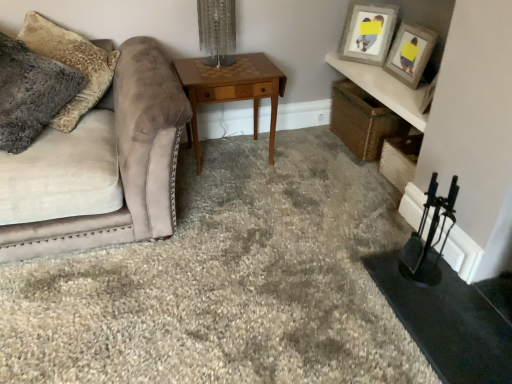
Question: Considering the relative sizes of matte gray picture frame at upper right, the first picture frame positioned from the right, and fuzzy gray pillow at left in the image provided, is matte gray picture frame at upper right, the first picture frame positioned from the right, thinner than fuzzy gray pillow at left?

Choices:
 (A) yes
 (B) no

Answer: (A)

Question: From a real-world perspective, is matte gray picture frame at upper right, the first picture frame positioned from the right, beneath fuzzy gray pillow at left?

Choices:
 (A) no
 (B) yes

Answer: (B)

Question: Is matte gray picture frame at upper right, the first picture frame positioned from the right, in contact with fuzzy gray pillow at left?

Choices:
 (A) yes
 (B) no

Answer: (B)

Question: Is matte gray picture frame at upper right, arranged as the 2th picture frame when viewed from the left, looking in the opposite direction of fuzzy gray pillow at left?

Choices:
 (A) yes
 (B) no

Answer: (B)

Question: Could you tell me if matte gray picture frame at upper right, the first picture frame positioned from the right, is facing fuzzy gray pillow at left?

Choices:
 (A) no
 (B) yes

Answer: (B)

Question: Considering the positions of point (182, 81) and point (202, 49), is point (182, 81) closer or farther from the camera than point (202, 49)?

Choices:
 (A) closer
 (B) farther

Answer: (A)

Question: Is woodenobject at center spatially inside clear glass table lamp at center, or outside of it?

Choices:
 (A) inside
 (B) outside

Answer: (B)

Question: Based on their positions, is woodenobject at center located to the left or right of clear glass table lamp at center?

Choices:
 (A) right
 (B) left

Answer: (A)

Question: From their relative heights in the image, would you say woodenobject at center is taller or shorter than clear glass table lamp at center?

Choices:
 (A) short
 (B) tall

Answer: (B)

Question: From the image's perspective, relative to fuzzy gray pillow at left, is matte gray picture frame at upper right, arranged as the second picture frame when viewed from the right, above or below?

Choices:
 (A) below
 (B) above

Answer: (B)

Question: Looking at the image, does matte gray picture frame at upper right, arranged as the second picture frame when viewed from the right, seem bigger or smaller compared to fuzzy gray pillow at left?

Choices:
 (A) big
 (B) small

Answer: (B)

Question: Is point (390, 18) closer or farther from the camera than point (38, 41)?

Choices:
 (A) closer
 (B) farther

Answer: (B)

Question: Considering the positions of matte gray picture frame at upper right, arranged as the second picture frame when viewed from the right, and fuzzy gray pillow at left in the image, is matte gray picture frame at upper right, arranged as the second picture frame when viewed from the right, taller or shorter than fuzzy gray pillow at left?

Choices:
 (A) short
 (B) tall

Answer: (A)

Question: Considering the positions of clear glass table lamp at center and matte gray picture frame at upper right, which appears as the first picture frame when viewed from the left, in the image, is clear glass table lamp at center wider or thinner than matte gray picture frame at upper right, which appears as the first picture frame when viewed from the left,?

Choices:
 (A) wide
 (B) thin

Answer: (A)

Question: Is point (224, 61) closer or farther from the camera than point (393, 8)?

Choices:
 (A) farther
 (B) closer

Answer: (B)